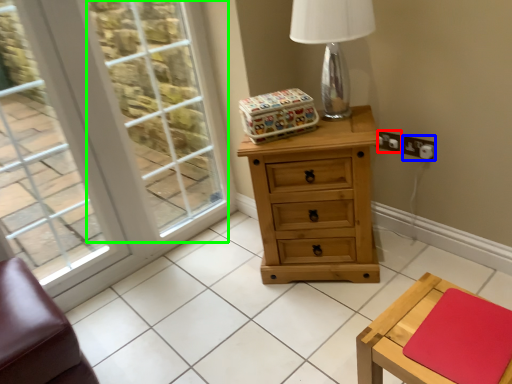
Question: Which object is the farthest from electric outlet (highlighted by a red box)? Choose among these: electric outlet (highlighted by a blue box) or window screen (highlighted by a green box).

Choices:
 (A) electric outlet
 (B) window screen

Answer: (B)